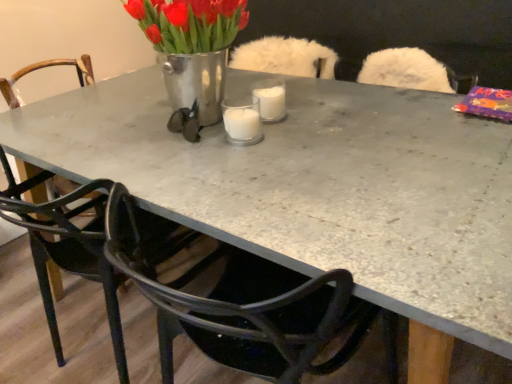
Image resolution: width=512 pixels, height=384 pixels. I want to click on vacant area to the left of clear glass candle at center, so click(x=168, y=142).